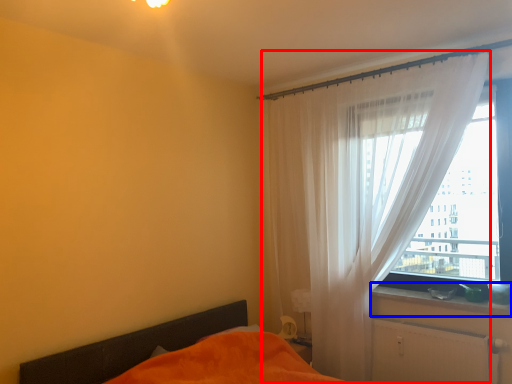
Question: Which object is closer to the camera taking this photo, curtain (highlighted by a red box) or window sill (highlighted by a blue box)?

Choices:
 (A) curtain
 (B) window sill

Answer: (A)